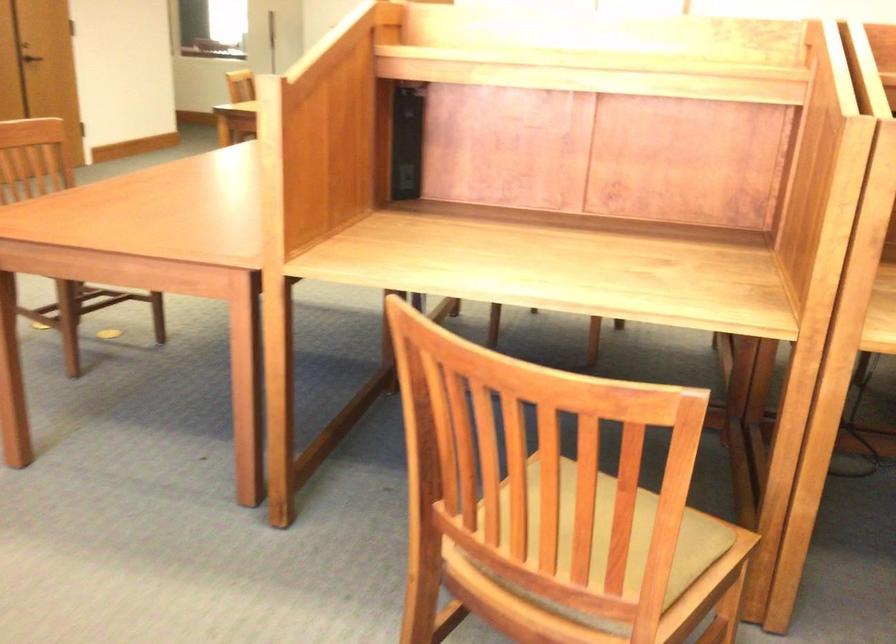
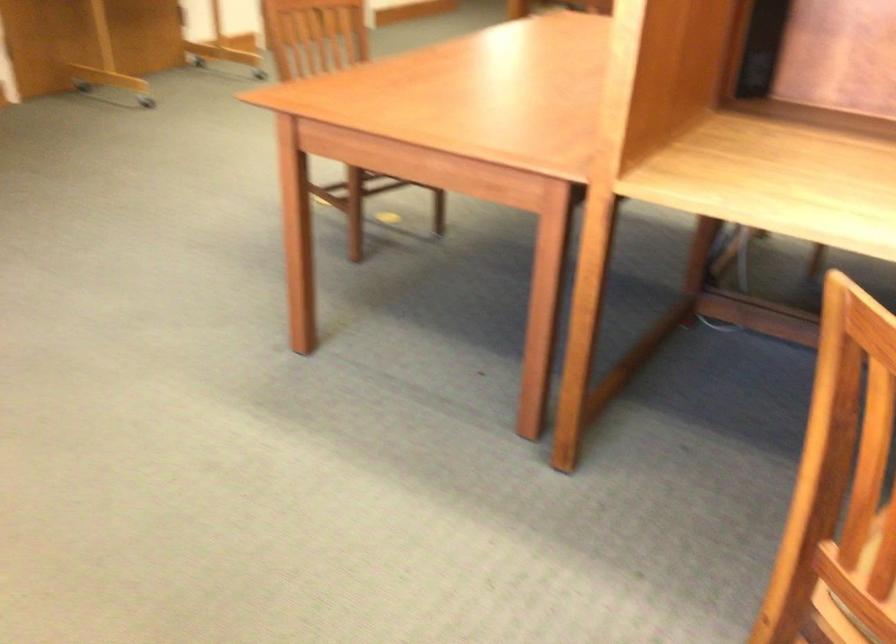
Question: The first image is from the beginning of the video and the second image is from the end. How did the camera likely rotate when shooting the video?

Choices:
 (A) Left
 (B) Right
 (C) Up
 (D) Down

Answer: (A)